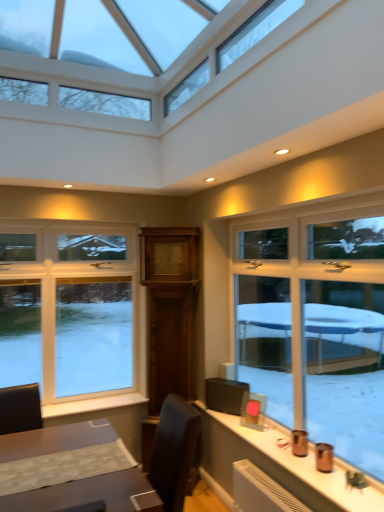
The height and width of the screenshot is (512, 384). What do you see at coordinates (92, 404) in the screenshot? I see `white painted wood at lower left` at bounding box center [92, 404].

This screenshot has width=384, height=512. I want to click on white painted wood at lower left, so click(x=92, y=404).

Describe the element at coordinates (79, 308) in the screenshot. The width and height of the screenshot is (384, 512). I see `white plastic window at left` at that location.

Where is `white plastic window at left`? Image resolution: width=384 pixels, height=512 pixels. white plastic window at left is located at coordinates (79, 308).

Locate an element on the screen. The width and height of the screenshot is (384, 512). white painted wood at lower left is located at coordinates (92, 404).

Considering the positions of objects white painted wood at lower left and white plastic window at left in the image provided, who is more to the left, white painted wood at lower left or white plastic window at left?

white plastic window at left.

Considering the positions of objects white painted wood at lower left and white plastic window at left in the image provided, who is behind, white painted wood at lower left or white plastic window at left?

white plastic window at left.

Considering the positions of point (137, 401) and point (117, 367), is point (137, 401) closer or farther from the camera than point (117, 367)?

Point (137, 401).

From the picture: From the image's perspective, which one is positioned lower, white painted wood at lower left or white plastic window at left?

From the image's view, white painted wood at lower left is below.

From a real-world perspective, which object stands above the other?

white plastic window at left is physically above.

In terms of width, does white painted wood at lower left look wider or thinner when compared to white plastic window at left?

In the image, white painted wood at lower left appears to be wider than white plastic window at left.

Is white painted wood at lower left shorter than white plastic window at left?

Yes, white painted wood at lower left is shorter than white plastic window at left.

Considering the sizes of objects white painted wood at lower left and white plastic window at left in the image provided, who is smaller, white painted wood at lower left or white plastic window at left?

With smaller size is white painted wood at lower left.

Is white painted wood at lower left positioned beyond the bounds of white plastic window at left?

Yes, white painted wood at lower left is not within white plastic window at left.

Is white painted wood at lower left positioned far away from white plastic window at left?

No, white painted wood at lower left is not far from white plastic window at left.

Does white painted wood at lower left turn towards white plastic window at left?

No.

The width and height of the screenshot is (384, 512). In order to click on window behind the white painted wood at lower left in this screenshot , I will do `click(79, 308)`.

Between white plastic window at left and white painted wood at lower left, which one appears on the left side from the viewer's perspective?

white plastic window at left.

Considering the positions of objects white plastic window at left and white painted wood at lower left in the image provided, who is behind, white plastic window at left or white painted wood at lower left?

Positioned behind is white plastic window at left.

Is point (131, 269) more distant than point (87, 401)?

Yes.

From the image's perspective, is white plastic window at left under white painted wood at lower left?

No, from the image's perspective, white plastic window at left is not below white painted wood at lower left.

From a real-world perspective, is white plastic window at left above or below white painted wood at lower left?

Clearly, from a real-world perspective, white plastic window at left is above white painted wood at lower left.

Can you confirm if white plastic window at left is wider than white painted wood at lower left?

No, white plastic window at left is not wider than white painted wood at lower left.

Based on the photo, considering the relative sizes of white plastic window at left and white painted wood at lower left in the image provided, is white plastic window at left taller than white painted wood at lower left?

Correct, white plastic window at left is much taller as white painted wood at lower left.

Based on their sizes in the image, would you say white plastic window at left is bigger or smaller than white painted wood at lower left?

white plastic window at left is bigger than white painted wood at lower left.

Can white painted wood at lower left be found inside white plastic window at left?

Actually, white painted wood at lower left is outside white plastic window at left.

Is white plastic window at left directly adjacent to white painted wood at lower left?

white plastic window at left is not next to white painted wood at lower left, and they're not touching.

Could you tell me if white plastic window at left is turned towards white painted wood at lower left?

Yes, white plastic window at left is turned towards white painted wood at lower left.

Where is `window sill in front of the white plastic window at left`? Image resolution: width=384 pixels, height=512 pixels. window sill in front of the white plastic window at left is located at coordinates (92, 404).

The height and width of the screenshot is (512, 384). In order to click on window sill on the right of white plastic window at left in this screenshot , I will do `click(92, 404)`.

Where is `window sill in front of the white plastic window at left`? window sill in front of the white plastic window at left is located at coordinates (92, 404).